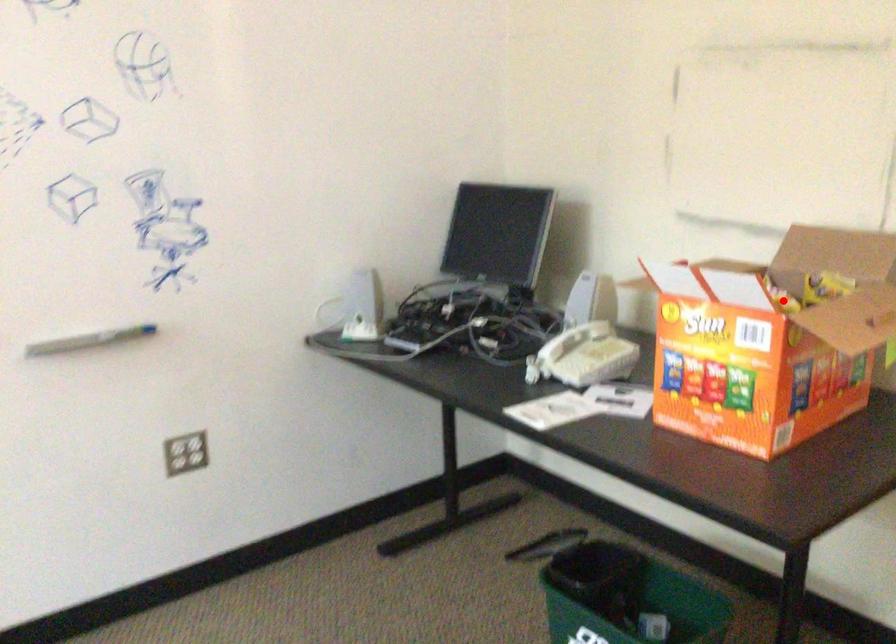
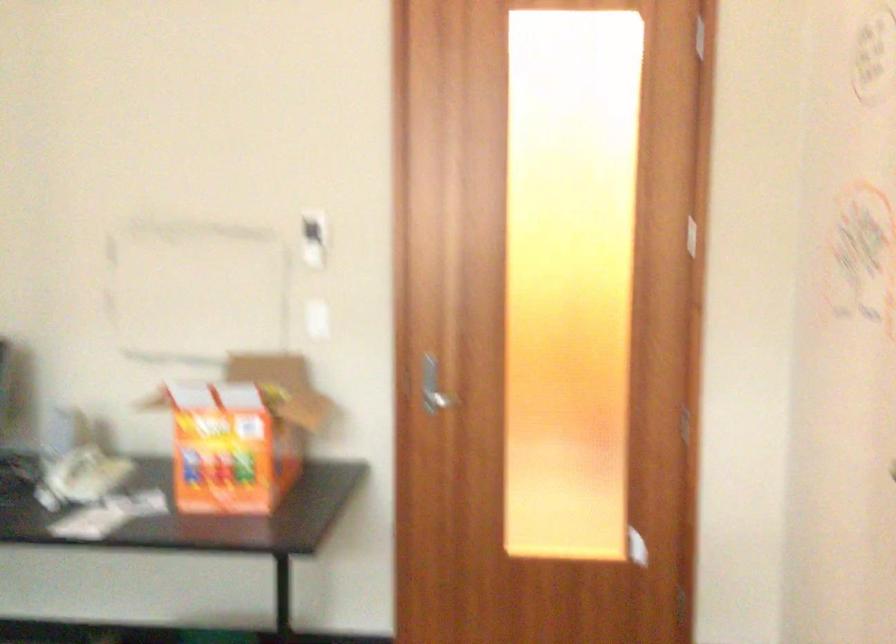
Locate, in the second image, the point that corresponds to the highlighted location in the first image.

(242, 408)